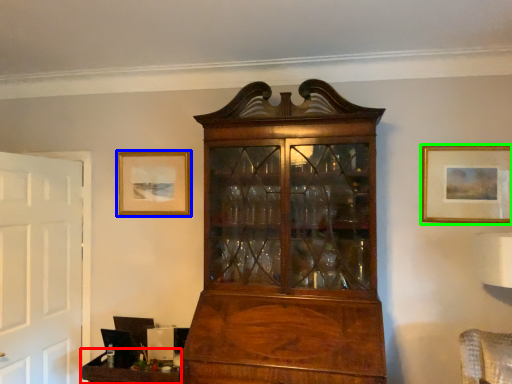
Question: Which object is the farthest from table (highlighted by a red box)? Choose among these: picture frame (highlighted by a blue box) or picture frame (highlighted by a green box).

Choices:
 (A) picture frame
 (B) picture frame

Answer: (B)